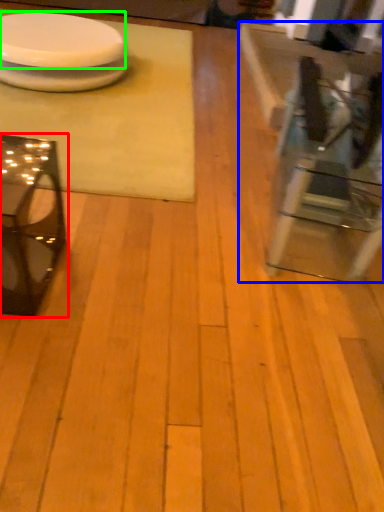
Question: Estimate the real-world distances between objects in this image. Which object is farther from table (highlighted by a red box), table (highlighted by a blue box) or platter (highlighted by a green box)?

Choices:
 (A) table
 (B) platter

Answer: (B)